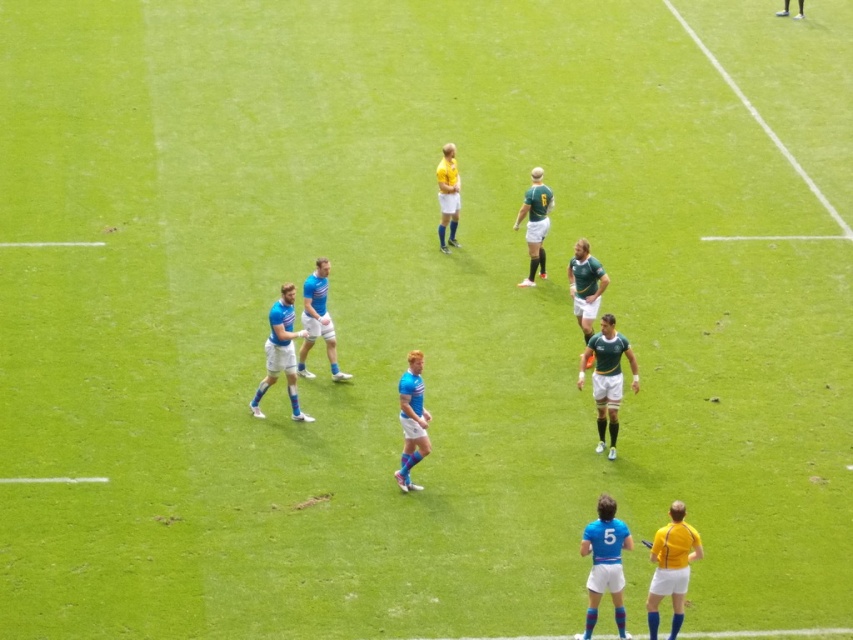
You are a photographer at the rugby match and need to capture a photo of both the matte blue jersey at center and the green matte jersey at center. Based on their heights, which jersey should you focus on first to ensure both are in frame?

The matte blue jersey at center is shorter than the green matte jersey at center, so you should focus on the green matte jersey at center first to ensure the shorter matte blue jersey at center is also captured in the frame.

You are a photographer standing at the edge of the rugby field. You want to capture a photo where the blue fabric jersey at center is clearly visible above the green grass at upper right. Based on their heights, is this possible?

The blue fabric jersey at center has a lesser height compared to green grass at upper right, so it would be difficult to capture a photo where the blue fabric jersey at center is clearly visible above the green grass at upper right because the grass is taller.